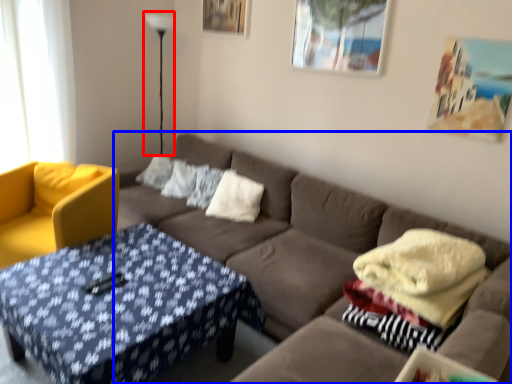
Question: Which point is further to the camera, lamp (highlighted by a red box) or studio couch (highlighted by a blue box)?

Choices:
 (A) lamp
 (B) studio couch

Answer: (A)